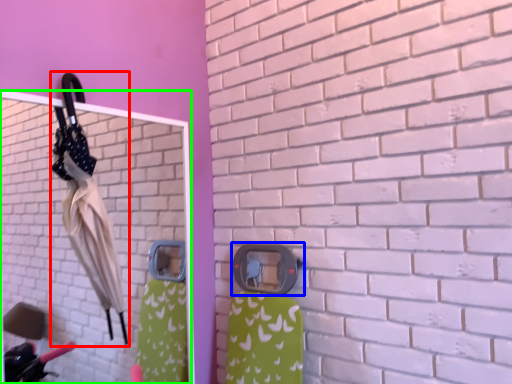
Question: Which object is positioned closest to umbrella (highlighted by a red box)? Select from door handle (highlighted by a blue box) and mirror (highlighted by a green box).

Choices:
 (A) door handle
 (B) mirror

Answer: (A)